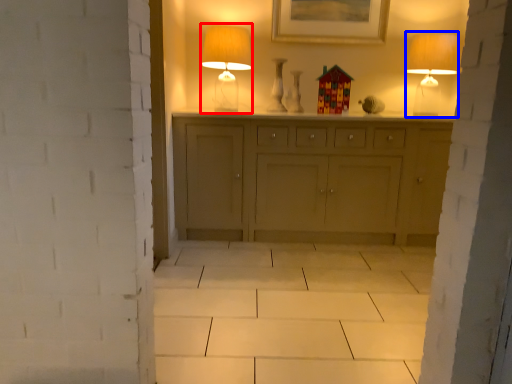
Question: Which point is closer to the camera, table lamp (highlighted by a red box) or table lamp (highlighted by a blue box)?

Choices:
 (A) table lamp
 (B) table lamp

Answer: (A)